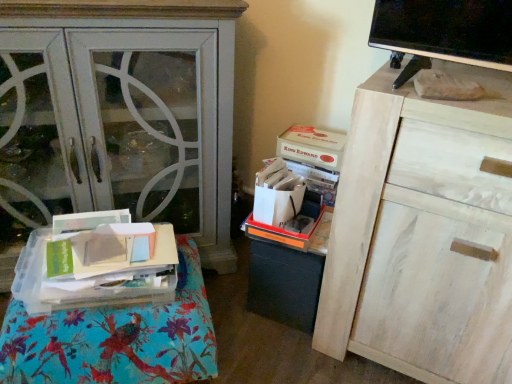
Identify the location of vacant area on top of clear plastic tray at lower left (from a real-world perspective). (98, 318).